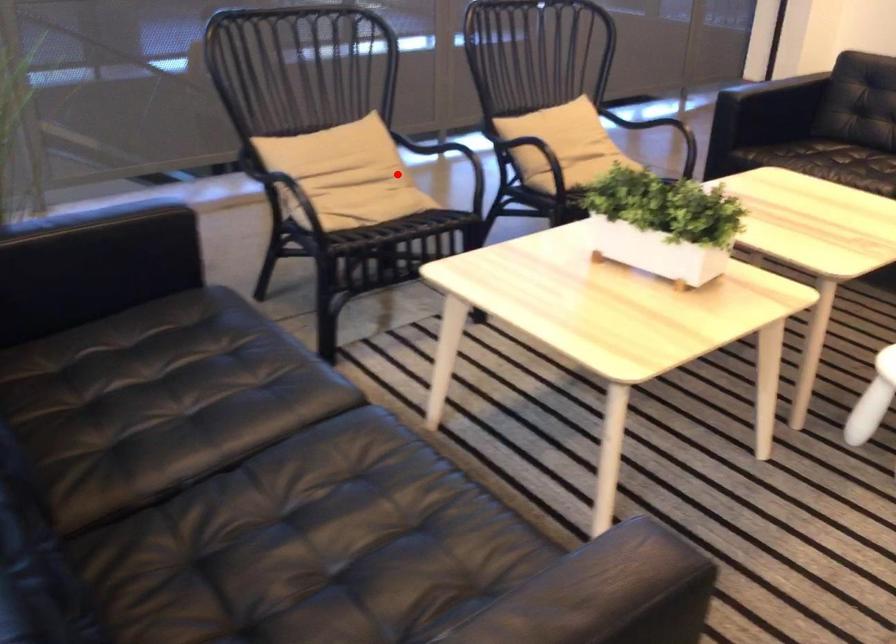
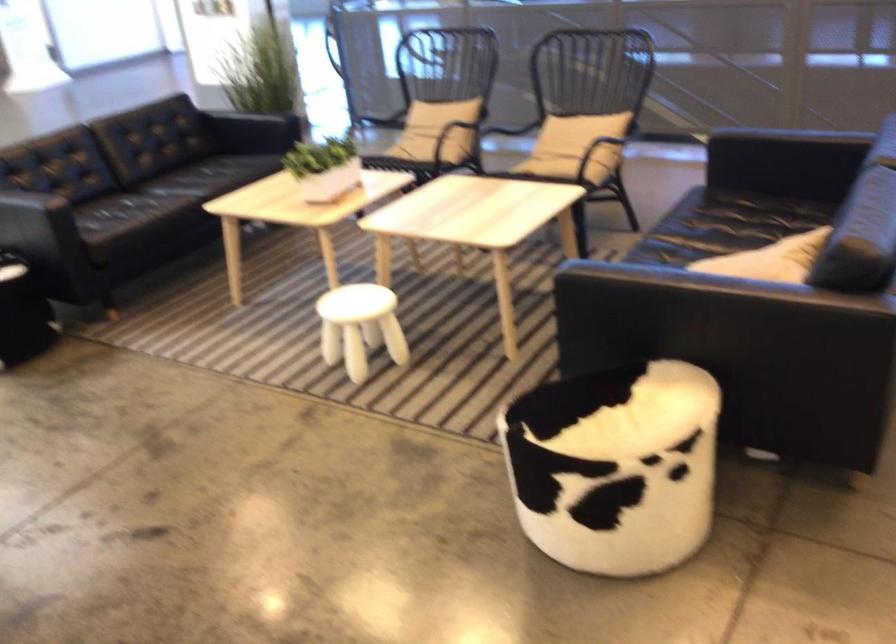
Where in the second image is the point corresponding to the highlighted location from the first image?

(440, 128)